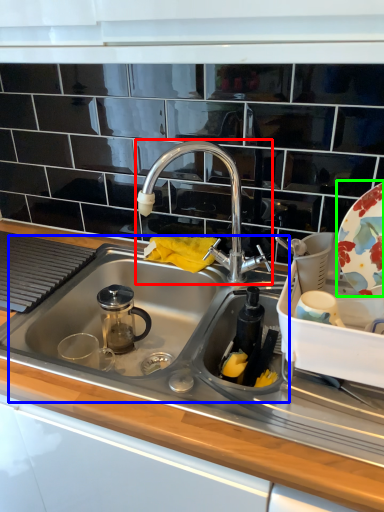
Question: Which object is positioned closest to tap (highlighted by a red box)? Select from sink (highlighted by a blue box) and platter (highlighted by a green box).

Choices:
 (A) sink
 (B) platter

Answer: (A)